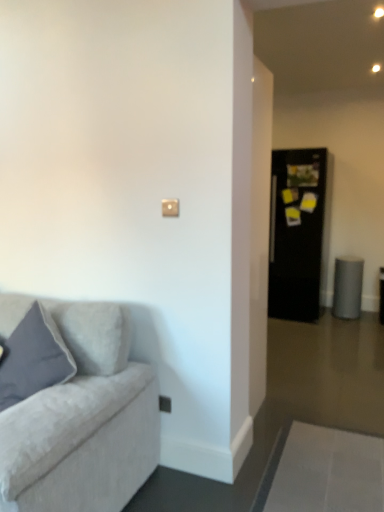
Question: Considering the relative sizes of matte gray pillow at left and satin silver outlet at lower center in the image provided, is matte gray pillow at left bigger than satin silver outlet at lower center?

Choices:
 (A) yes
 (B) no

Answer: (A)

Question: From the image's perspective, is matte gray pillow at left on satin silver outlet at lower center?

Choices:
 (A) yes
 (B) no

Answer: (A)

Question: Is satin silver outlet at lower center surrounded by matte gray pillow at left?

Choices:
 (A) yes
 (B) no

Answer: (B)

Question: Can you see matte gray pillow at left touching satin silver outlet at lower center?

Choices:
 (A) yes
 (B) no

Answer: (B)

Question: Considering the relative positions of matte gray pillow at left and satin silver outlet at lower center in the image provided, is matte gray pillow at left to the right of satin silver outlet at lower center from the viewer's perspective?

Choices:
 (A) yes
 (B) no

Answer: (B)

Question: Does matte gray pillow at left come in front of satin silver outlet at lower center?

Choices:
 (A) yes
 (B) no

Answer: (A)

Question: Can we say black glossy refrigerator at right lies outside satin silver outlet at lower center?

Choices:
 (A) yes
 (B) no

Answer: (A)

Question: Is black glossy refrigerator at right behind satin silver outlet at lower center?

Choices:
 (A) no
 (B) yes

Answer: (B)

Question: Can you confirm if black glossy refrigerator at right is positioned to the left of satin silver outlet at lower center?

Choices:
 (A) yes
 (B) no

Answer: (B)

Question: From a real-world perspective, is black glossy refrigerator at right physically below satin silver outlet at lower center?

Choices:
 (A) no
 (B) yes

Answer: (A)

Question: From a real-world perspective, is black glossy refrigerator at right physically above satin silver outlet at lower center?

Choices:
 (A) yes
 (B) no

Answer: (A)

Question: Does black glossy refrigerator at right have a lesser width compared to satin silver outlet at lower center?

Choices:
 (A) no
 (B) yes

Answer: (A)

Question: From a real-world perspective, is satin silver outlet at lower center located beneath matte gray pillow at left?

Choices:
 (A) yes
 (B) no

Answer: (A)